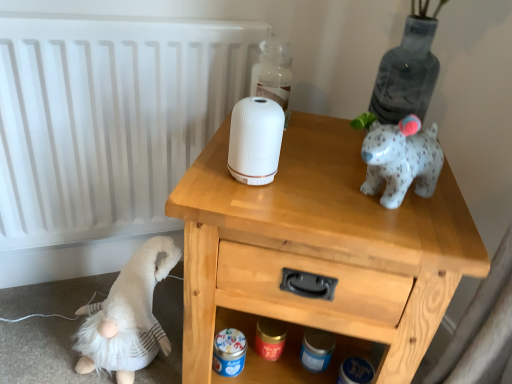
Question: Is white matte radiator at upper left positioned beyond the bounds of white matte speaker at center?

Choices:
 (A) no
 (B) yes

Answer: (B)

Question: Can you confirm if white matte radiator at upper left is taller than white matte speaker at center?

Choices:
 (A) yes
 (B) no

Answer: (A)

Question: Considering the relative positions of white matte radiator at upper left and white matte speaker at center in the image provided, is white matte radiator at upper left in front of white matte speaker at center?

Choices:
 (A) yes
 (B) no

Answer: (B)

Question: From the image's perspective, does white matte radiator at upper left appear higher than white matte speaker at center?

Choices:
 (A) yes
 (B) no

Answer: (A)

Question: Considering the relative sizes of white matte radiator at upper left and white matte speaker at center in the image provided, is white matte radiator at upper left bigger than white matte speaker at center?

Choices:
 (A) yes
 (B) no

Answer: (A)

Question: Is white matte radiator at upper left smaller than white matte speaker at center?

Choices:
 (A) yes
 (B) no

Answer: (B)

Question: Is wooden nightstand at upper center positioned before white matte radiator at upper left?

Choices:
 (A) no
 (B) yes

Answer: (B)

Question: Is wooden nightstand at upper center wider than white matte radiator at upper left?

Choices:
 (A) no
 (B) yes

Answer: (B)

Question: From the image's perspective, would you say wooden nightstand at upper center is positioned over white matte radiator at upper left?

Choices:
 (A) no
 (B) yes

Answer: (A)

Question: Considering the relative positions of wooden nightstand at upper center and white matte radiator at upper left in the image provided, is wooden nightstand at upper center behind white matte radiator at upper left?

Choices:
 (A) yes
 (B) no

Answer: (B)

Question: From a real-world perspective, is wooden nightstand at upper center over white matte radiator at upper left?

Choices:
 (A) no
 (B) yes

Answer: (A)

Question: Is wooden nightstand at upper center bigger than white matte radiator at upper left?

Choices:
 (A) yes
 (B) no

Answer: (A)

Question: Is the position of transparent glass bottle at upper center more distant than that of wooden nightstand at upper center?

Choices:
 (A) yes
 (B) no

Answer: (A)